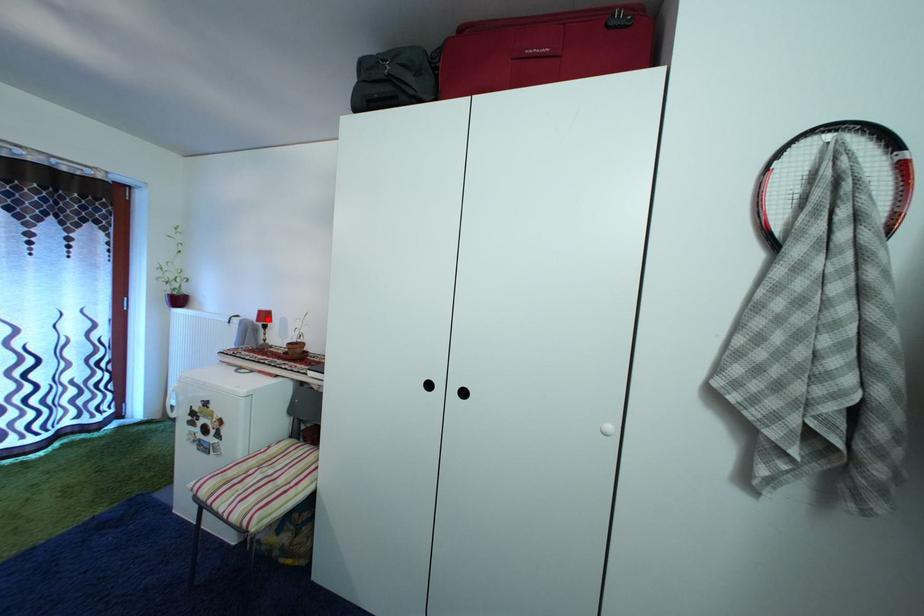
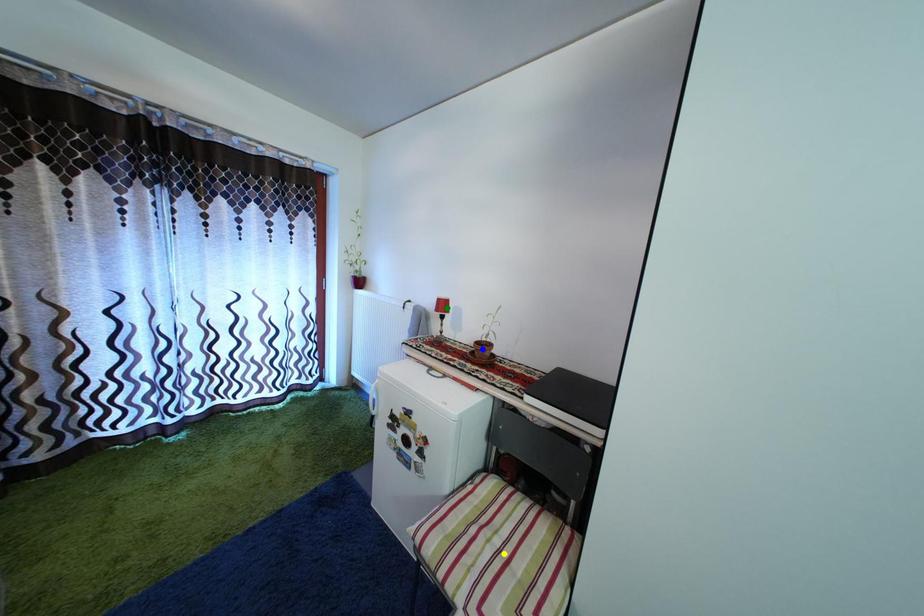
Question: I am providing you with two images of the same scene from different viewpoints. A red point is marked on the first image. You are given multiple points on the second image. Which spot in image 2 lines up with the point in image 1?

Choices:
 (A) yellow point
 (B) blue point
 (C) green point

Answer: (C)